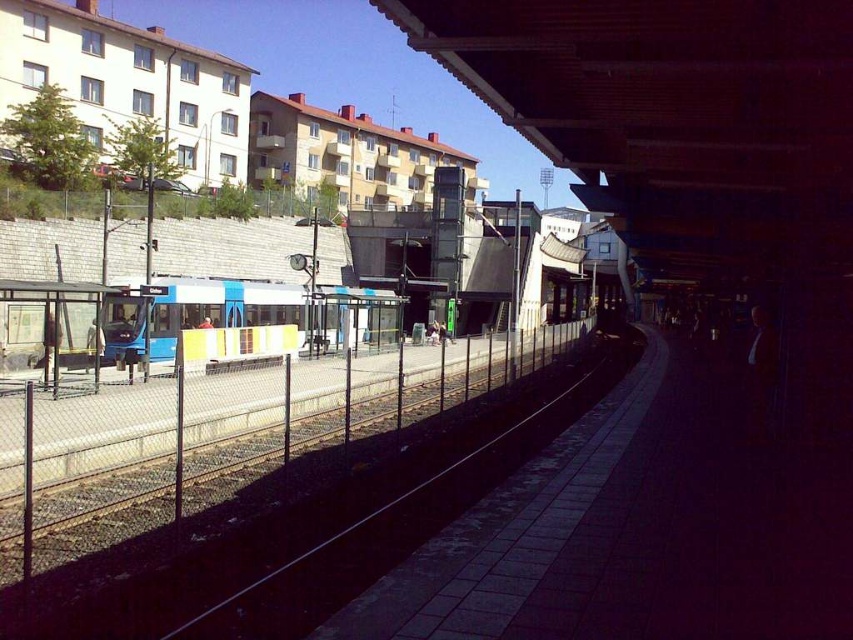
Question: Does metal mesh fence at left appear on the right side of transparent plastic bus stop at left?

Choices:
 (A) no
 (B) yes

Answer: (B)

Question: Is metal mesh fence at left wider than blue metallic train at center?

Choices:
 (A) yes
 (B) no

Answer: (A)

Question: Which point appears closest to the camera in this image?

Choices:
 (A) (350, 330)
 (B) (149, 426)
 (C) (22, 307)

Answer: (B)

Question: Based on their relative distances, which object is farther from the metal mesh fence at left?

Choices:
 (A) transparent plastic bus stop at left
 (B) blue metallic train at center

Answer: (B)

Question: Can you confirm if metal mesh fence at left is bigger than blue metallic train at center?

Choices:
 (A) no
 (B) yes

Answer: (A)

Question: Which object is farther from the camera taking this photo?

Choices:
 (A) blue metallic train at center
 (B) transparent plastic bus stop at left

Answer: (A)